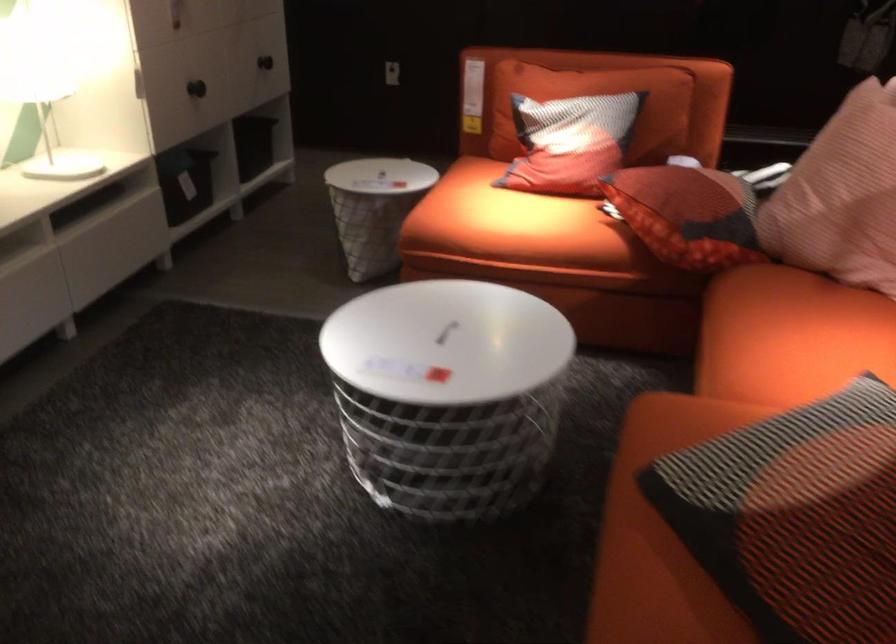
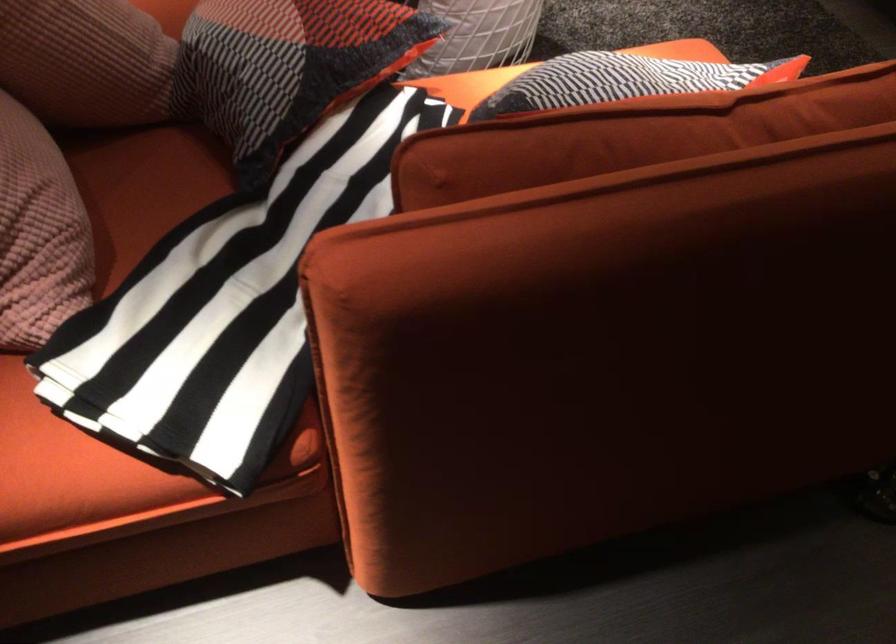
In the second image, find the point that corresponds to (807,169) in the first image.

(85, 61)